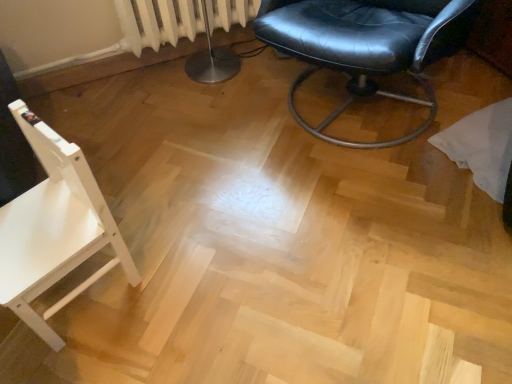
At what (x,y) coordinates should I click in order to perform the action: click on vacant area that is in front of black leather chair at center, which appears as the 1th chair when viewed from the top. Please return your answer as a coordinate pair (x, y). Looking at the image, I should click on (348, 237).